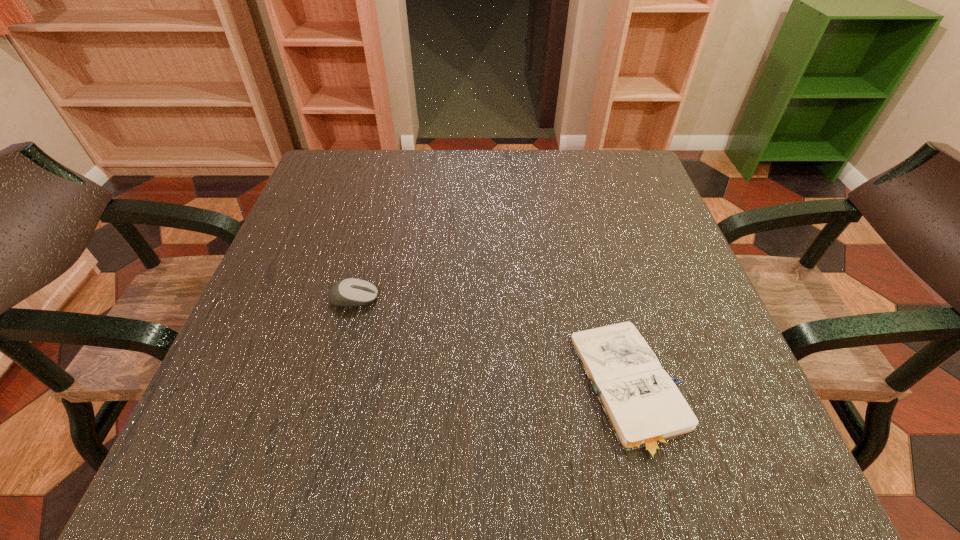
Where is `free spot that satisfies the following two spatial constraints: 1. on the wheel side of the shorter object; 2. on the left side of the taller object`? The width and height of the screenshot is (960, 540). free spot that satisfies the following two spatial constraints: 1. on the wheel side of the shorter object; 2. on the left side of the taller object is located at coordinates (330, 389).

The image size is (960, 540). Find the location of `free space that satisfies the following two spatial constraints: 1. on the back side of the shorter object; 2. on the wheel side of the taller object`. free space that satisfies the following two spatial constraints: 1. on the back side of the shorter object; 2. on the wheel side of the taller object is located at coordinates (608, 298).

Identify the location of free spot that satisfies the following two spatial constraints: 1. on the wheel side of the notebook; 2. on the left side of the taller object. (330, 389).